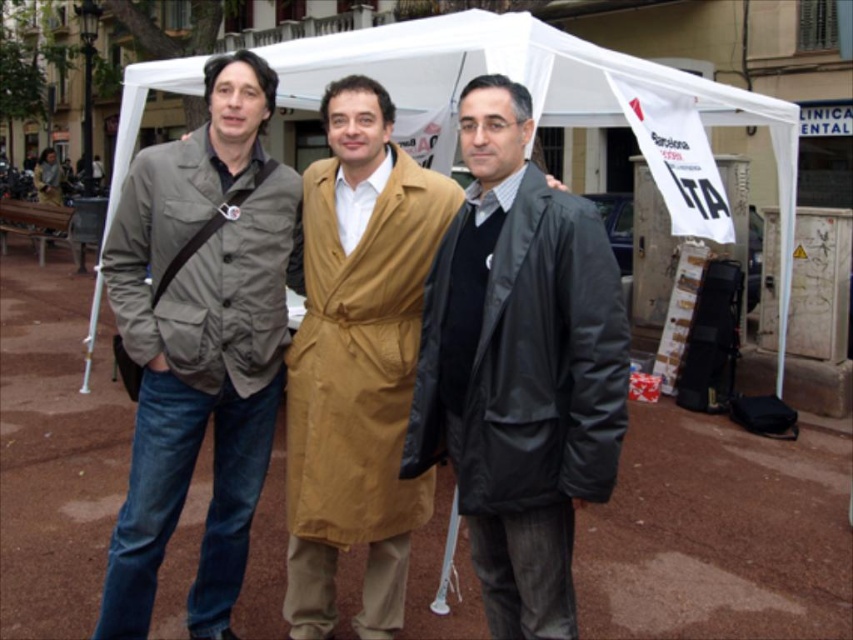
You are a photographer standing in front of the three men. You need to capture a group photo where all of them fit in the frame. Based on their clothing, which of the two coats, the matte black coat at center or the matte gray jacket at left, will require more space between the photographer and the subjects to ensure it fits in the frame?

The matte gray jacket at left has a greater width than the matte black coat at center, so it will require more space between the photographer and the subjects to ensure it fits in the frame.